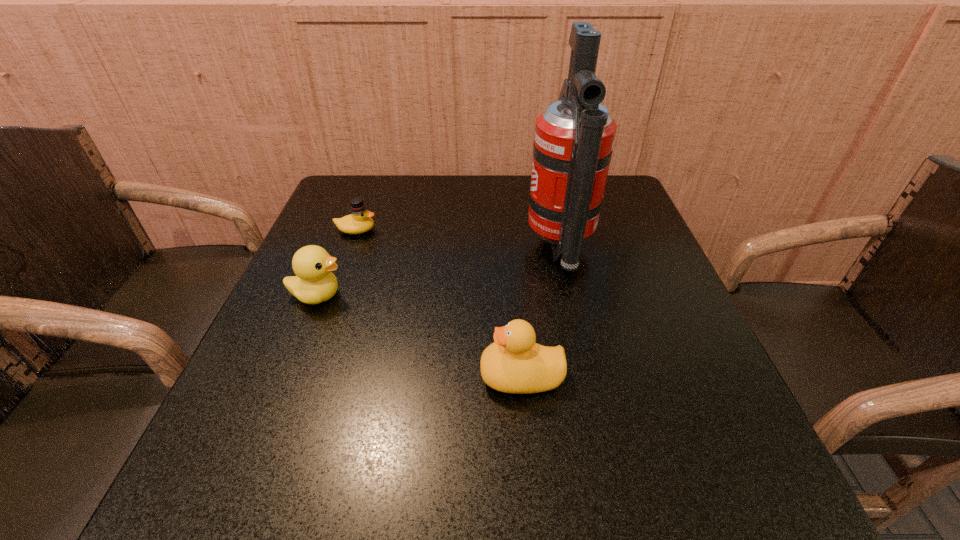
Where is `free point between the second farthest duck and the shortest duck`? Image resolution: width=960 pixels, height=540 pixels. free point between the second farthest duck and the shortest duck is located at coordinates (337, 262).

This screenshot has width=960, height=540. I want to click on empty space between the fire extinguisher and the second nearest duck, so click(439, 272).

Where is `free space between the tallest object and the nearest object`? Image resolution: width=960 pixels, height=540 pixels. free space between the tallest object and the nearest object is located at coordinates (540, 312).

Locate an element on the screen. This screenshot has height=540, width=960. free spot between the tallest object and the second nearest duck is located at coordinates (439, 272).

Where is `object that is the third closest to the shortest object`? Image resolution: width=960 pixels, height=540 pixels. object that is the third closest to the shortest object is located at coordinates [x=514, y=363].

Locate which object ranks third in proximity to the shortest duck. Please provide its 2D coordinates. Your answer should be formatted as a tuple, i.e. [(x, y)], where the tuple contains the x and y coordinates of a point satisfying the conditions above.

[(514, 363)]

This screenshot has height=540, width=960. In order to click on duck that is the closest to the shortest duck in this screenshot , I will do `click(314, 283)`.

Where is `duck that is the closest to the nearest duck`? The width and height of the screenshot is (960, 540). duck that is the closest to the nearest duck is located at coordinates (314, 283).